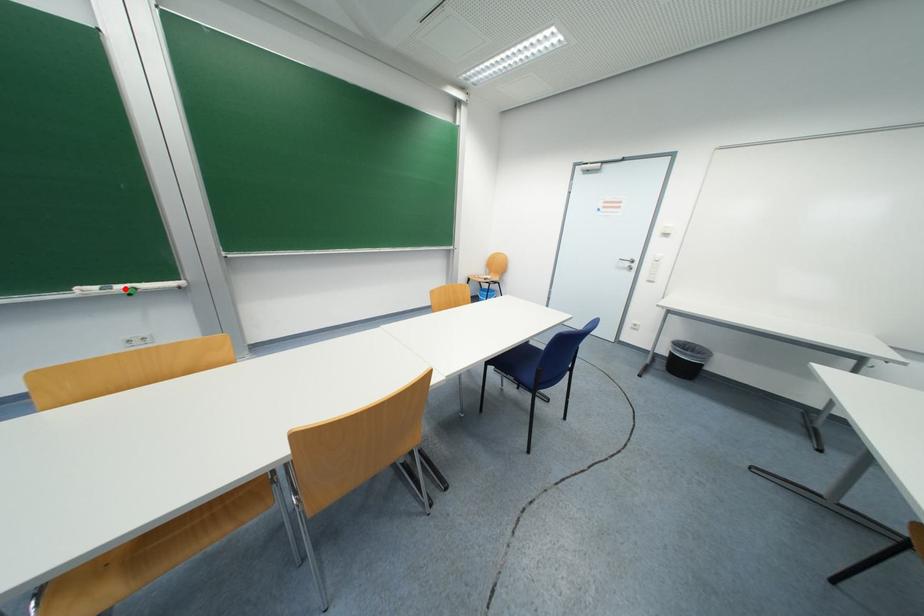
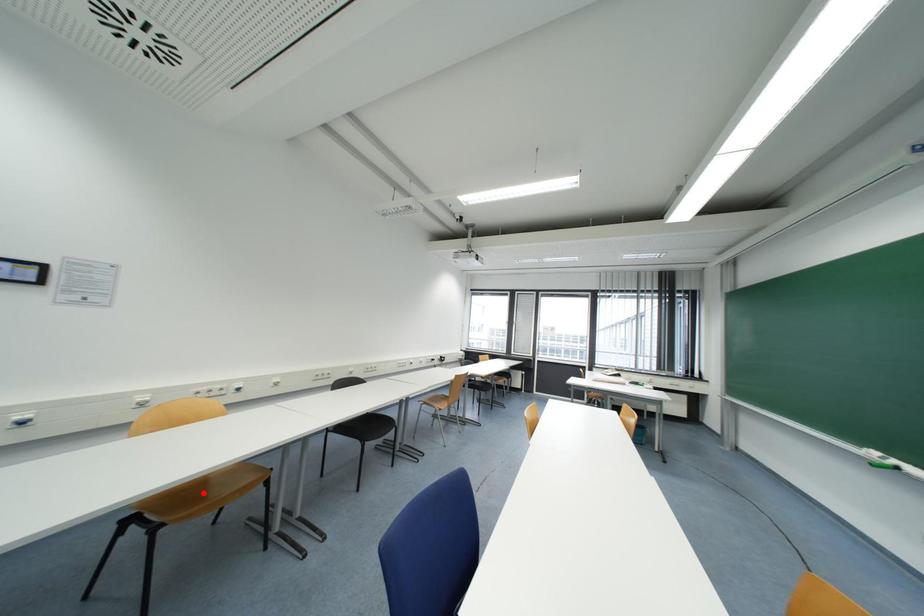
Based on the photo, I am providing you with two images of the same scene from different viewpoints. A red point is marked on the first image and another point is marked on the second image. Is the marked point in image1 the same physical position as the marked point in image2?

No